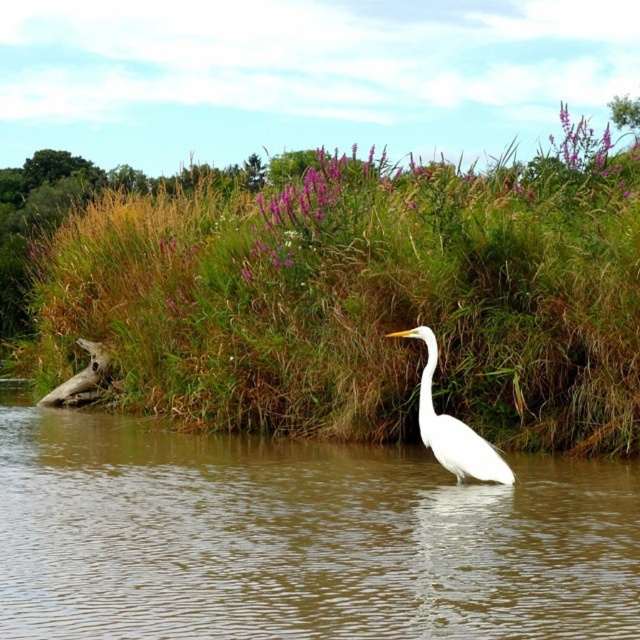
Is green grass at center taller than white smooth heron at center?

Indeed, green grass at center has a greater height compared to white smooth heron at center.

Where is `green grass at center`? This screenshot has width=640, height=640. green grass at center is located at coordinates (360, 296).

Who is more forward, (561,157) or (436,436)?

Point (436,436) is in front.

Image resolution: width=640 pixels, height=640 pixels. Find the location of `green grass at center`. green grass at center is located at coordinates (360, 296).

Does green grass at center appear on the right side of brown muddy water at center?

Correct, you'll find green grass at center to the right of brown muddy water at center.

Can you confirm if green grass at center is taller than brown muddy water at center?

Indeed, green grass at center has a greater height compared to brown muddy water at center.

Which is in front, point (100, 275) or point (129, 472)?

Point (129, 472)

The image size is (640, 640). Identify the location of green grass at center. (360, 296).

Can you confirm if brown muddy water at center is thinner than white smooth heron at center?

No.

Who is shorter, brown muddy water at center or white smooth heron at center?

brown muddy water at center is shorter.

The height and width of the screenshot is (640, 640). What do you see at coordinates (298, 538) in the screenshot? I see `brown muddy water at center` at bounding box center [298, 538].

The width and height of the screenshot is (640, 640). Identify the location of brown muddy water at center. (298, 538).